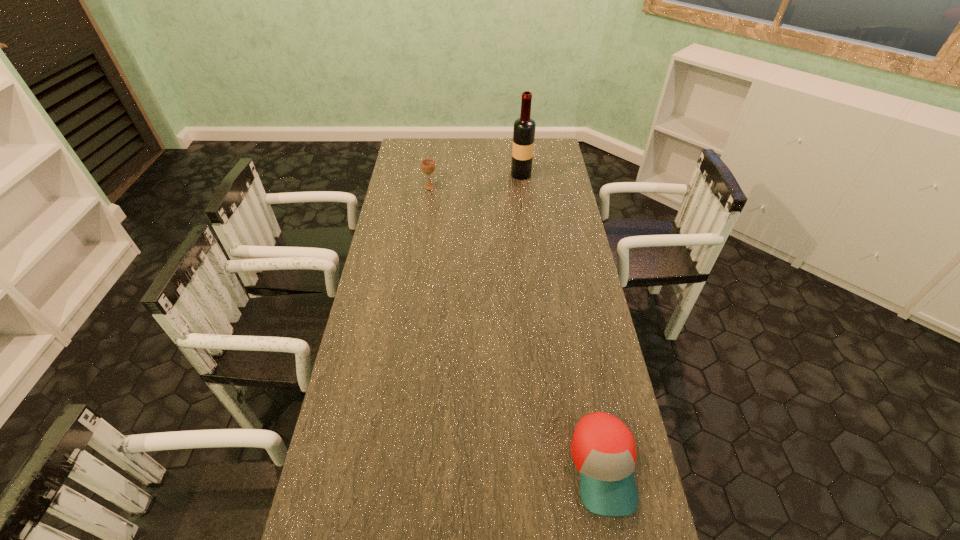
Image resolution: width=960 pixels, height=540 pixels. What are the coordinates of `free point between the second tallest object and the farthest object` in the screenshot? It's located at click(475, 181).

Find the location of a particular element. object identified as the closest to the tallest object is located at coordinates [428, 165].

Find the location of a particular element. The image size is (960, 540). object that is the second closest to the baseball cap is located at coordinates (524, 127).